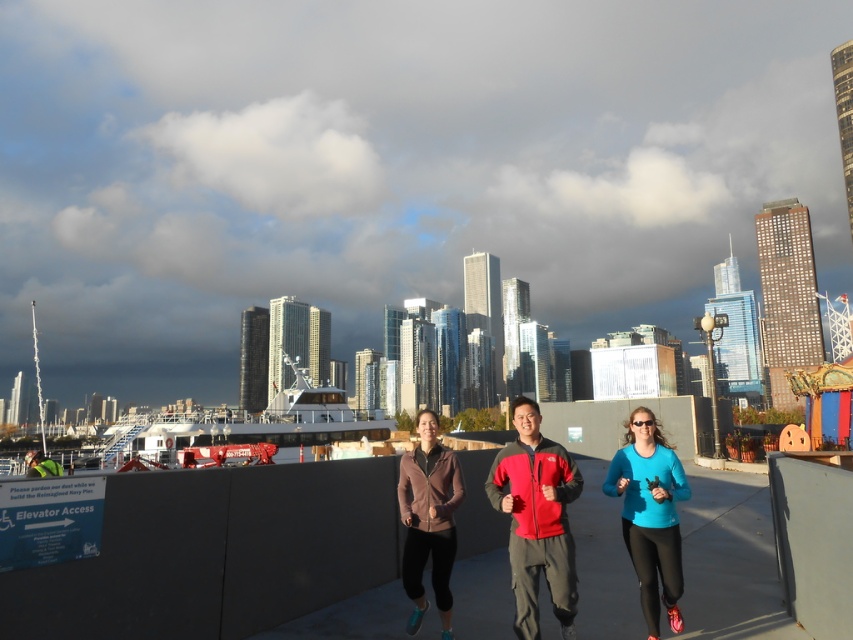
Question: Can you confirm if matte blue top at center is positioned to the right of matte pink jacket at center?

Choices:
 (A) yes
 (B) no

Answer: (A)

Question: Is matte blue top at center further to camera compared to matte pink jacket at center?

Choices:
 (A) yes
 (B) no

Answer: (B)

Question: Is matte blue top at center smaller than matte pink jacket at center?

Choices:
 (A) no
 (B) yes

Answer: (B)

Question: Which point is closer to the camera taking this photo?

Choices:
 (A) (671, 561)
 (B) (434, 522)

Answer: (A)